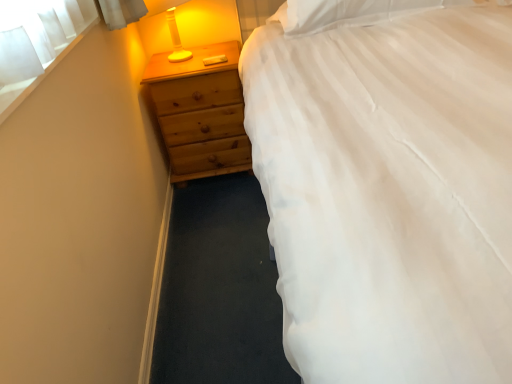
Question: Can you confirm if white soft pillow at upper right is bigger than wooden chest of drawers at left?

Choices:
 (A) no
 (B) yes

Answer: (A)

Question: From a real-world perspective, is white soft pillow at upper right physically below wooden chest of drawers at left?

Choices:
 (A) no
 (B) yes

Answer: (A)

Question: Can you confirm if white soft pillow at upper right is shorter than wooden chest of drawers at left?

Choices:
 (A) no
 (B) yes

Answer: (B)

Question: Is white soft pillow at upper right closer to the viewer compared to wooden chest of drawers at left?

Choices:
 (A) yes
 (B) no

Answer: (A)

Question: From the image's perspective, is white soft pillow at upper right above wooden chest of drawers at left?

Choices:
 (A) yes
 (B) no

Answer: (A)

Question: Is white soft pillow at upper right next to wooden chest of drawers at left?

Choices:
 (A) yes
 (B) no

Answer: (B)

Question: From the image's perspective, is white fabric at upper left below wooden chest of drawers at left?

Choices:
 (A) yes
 (B) no

Answer: (A)

Question: Is the depth of white fabric at upper left greater than that of wooden chest of drawers at left?

Choices:
 (A) no
 (B) yes

Answer: (A)

Question: Does white fabric at upper left appear on the right side of wooden chest of drawers at left?

Choices:
 (A) no
 (B) yes

Answer: (A)

Question: Would you consider white fabric at upper left to be distant from wooden chest of drawers at left?

Choices:
 (A) yes
 (B) no

Answer: (B)

Question: From a real-world perspective, is white fabric at upper left on top of wooden chest of drawers at left?

Choices:
 (A) no
 (B) yes

Answer: (B)

Question: From a real-world perspective, is white fabric at upper left located beneath wooden chest of drawers at left?

Choices:
 (A) no
 (B) yes

Answer: (A)

Question: Does white fabric at upper left turn towards white soft pillow at upper right?

Choices:
 (A) no
 (B) yes

Answer: (A)